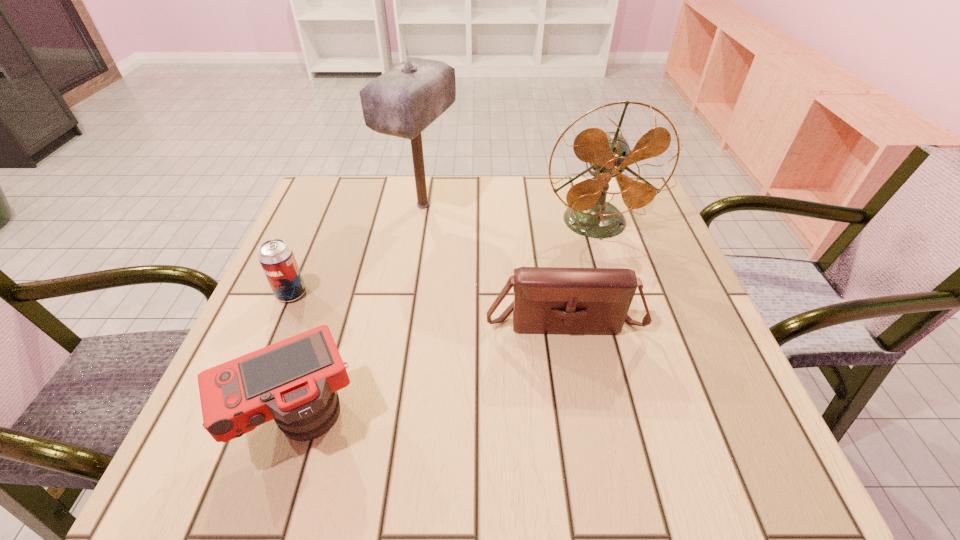
Find the location of a particular element. empty location between the fourth shortest object and the beer can is located at coordinates (444, 258).

Locate an element on the screen. This screenshot has width=960, height=540. empty space that is in between the beer can and the fan is located at coordinates (444, 258).

Image resolution: width=960 pixels, height=540 pixels. Find the location of `vacant space that's between the mallet and the beer can`. vacant space that's between the mallet and the beer can is located at coordinates (357, 249).

Point out which object is positioned as the third nearest to the camera. Please provide its 2D coordinates. Your answer should be formatted as a tuple, i.e. [(x, y)], where the tuple contains the x and y coordinates of a point satisfying the conditions above.

[(402, 102)]

Select which object appears as the fourth closest to the fan. Please provide its 2D coordinates. Your answer should be formatted as a tuple, i.e. [(x, y)], where the tuple contains the x and y coordinates of a point satisfying the conditions above.

[(276, 257)]